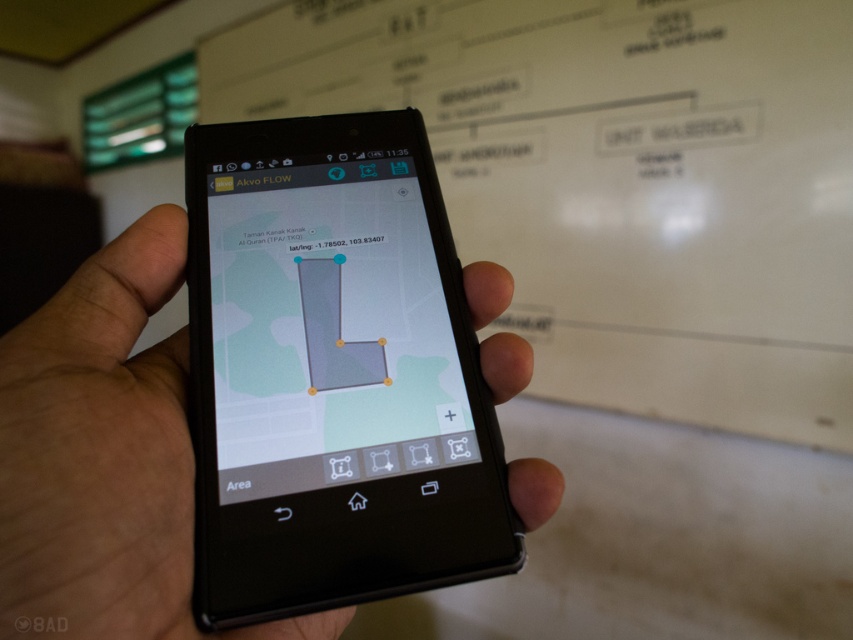
Find the location of `black matte phone at center`. black matte phone at center is located at coordinates (105, 458).